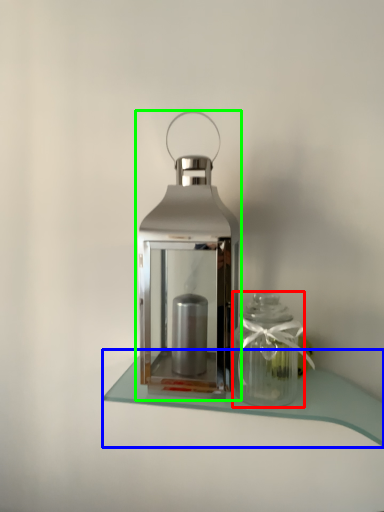
Question: Estimate the real-world distances between objects in this image. Which object is farther from glass vase (highlighted by a red box), table (highlighted by a blue box) or lantern (highlighted by a green box)?

Choices:
 (A) table
 (B) lantern

Answer: (B)